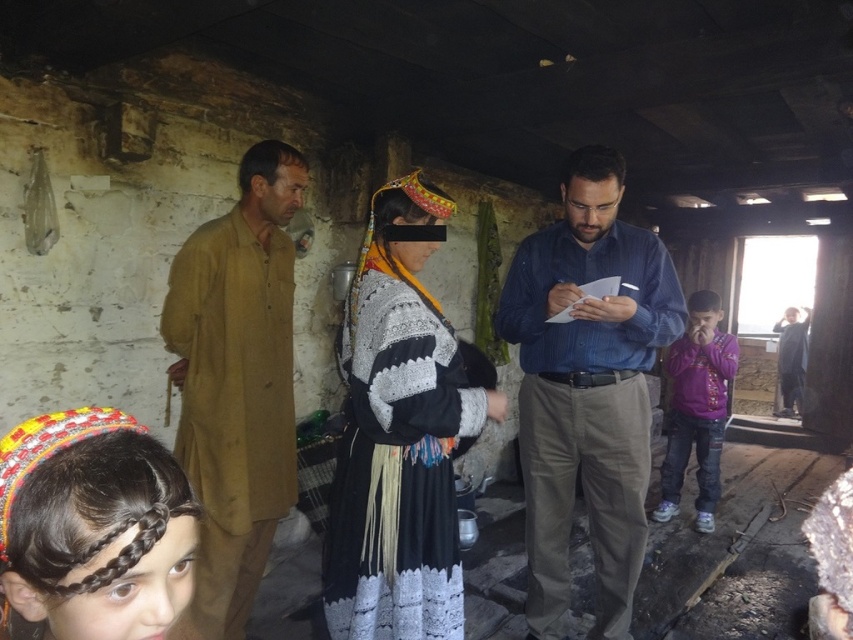
Which is more to the left, brown cotton robe at left or purple denim jeans at right?

Positioned to the left is brown cotton robe at left.

Can you confirm if brown cotton robe at left is thinner than purple denim jeans at right?

Yes, brown cotton robe at left is thinner than purple denim jeans at right.

This screenshot has width=853, height=640. What do you see at coordinates (236, 384) in the screenshot?
I see `brown cotton robe at left` at bounding box center [236, 384].

Where is `brown cotton robe at left`? The image size is (853, 640). brown cotton robe at left is located at coordinates (236, 384).

Between point (422, 561) and point (701, 324), which one is positioned behind?

The point (701, 324) is behind.

Consider the image. Is knitted woolen dress at center below purple denim jeans at right?

Actually, knitted woolen dress at center is above purple denim jeans at right.

The image size is (853, 640). I want to click on knitted woolen dress at center, so click(x=399, y=435).

Identify the location of knitted woolen dress at center. (399, 435).

Between point (566, 460) and point (369, 634), which one is positioned in front?

Point (369, 634) is in front.

Is the position of blue striped shirt at center less distant than that of knitted woolen dress at center?

No, it is not.

Is point (601, 333) positioned before point (442, 525)?

No.

I want to click on blue striped shirt at center, so click(585, 388).